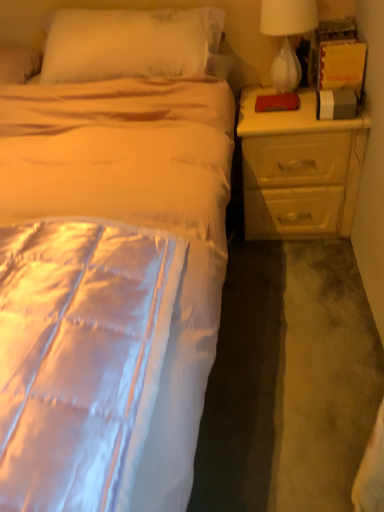
Question: Choose the correct answer: Is white glass lamp at upper right inside silky white bed at center or outside it?

Choices:
 (A) inside
 (B) outside

Answer: (A)

Question: Is white glass lamp at upper right taller or shorter than silky white bed at center?

Choices:
 (A) tall
 (B) short

Answer: (B)

Question: Which object is positioned farthest from the silky white bed at center?

Choices:
 (A) yellow matte nightstand at right
 (B) white glass lamp at upper right

Answer: (B)

Question: Considering the real-world distances, which object is closest to the yellow matte nightstand at right?

Choices:
 (A) white glass lamp at upper right
 (B) silky white bed at center

Answer: (A)